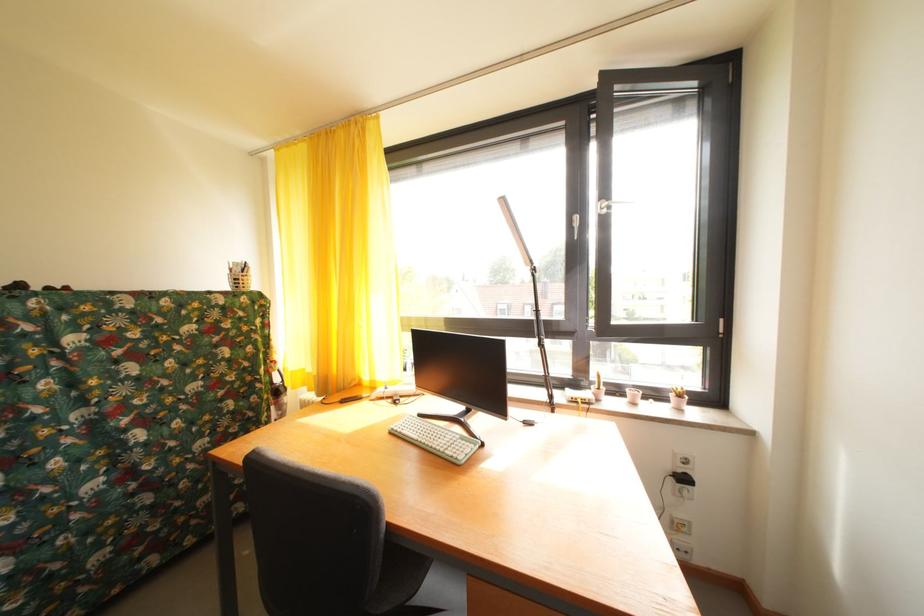
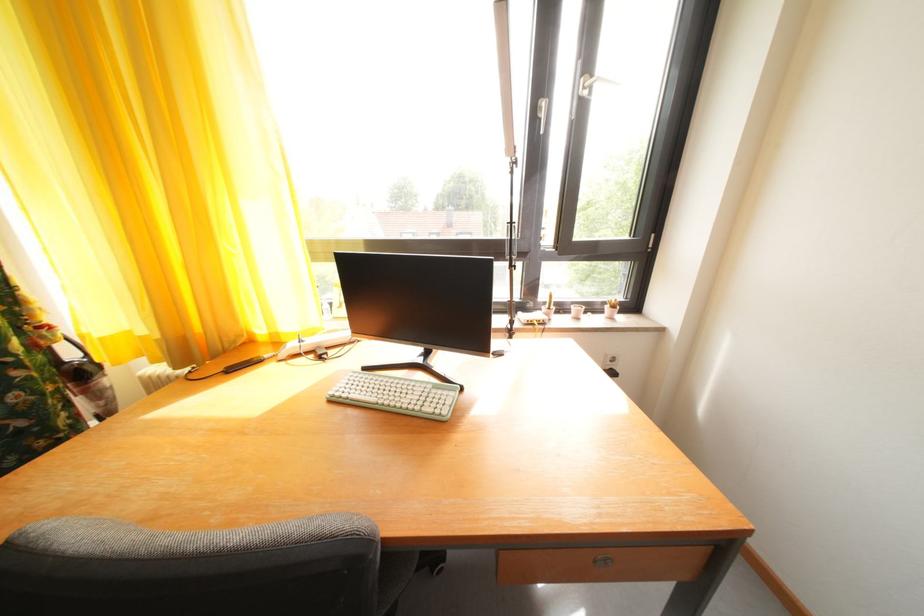
First-person continuous shooting, in which direction is the camera rotating?

The camera's rotation is toward right-down.